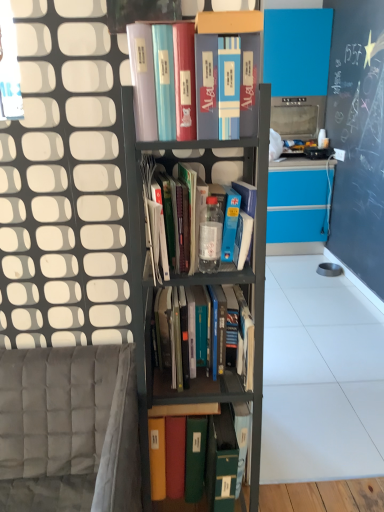
Question: From a real-world perspective, does gray fabric armchair at lower left sit lower than translucent plastic bottle at center, positioned as the 2th book in top-to-bottom order?

Choices:
 (A) yes
 (B) no

Answer: (A)

Question: Are gray fabric armchair at lower left and translucent plastic bottle at center, positioned as the 3th book in bottom-to-top order, located far from each other?

Choices:
 (A) no
 (B) yes

Answer: (A)

Question: From the image's perspective, would you say gray fabric armchair at lower left is shown under translucent plastic bottle at center, positioned as the 2th book in top-to-bottom order?

Choices:
 (A) yes
 (B) no

Answer: (A)

Question: Could you tell me if gray fabric armchair at lower left is facing translucent plastic bottle at center, positioned as the 2th book in top-to-bottom order?

Choices:
 (A) yes
 (B) no

Answer: (B)

Question: Is gray fabric armchair at lower left positioned in front of translucent plastic bottle at center, positioned as the 3th book in bottom-to-top order?

Choices:
 (A) no
 (B) yes

Answer: (B)

Question: Considering the relative positions of hardcover books at center, which appears as the 2th book when ordered from the bottom, and translucent plastic bottle at center, positioned as the 2th book in top-to-bottom order, in the image provided, is hardcover books at center, which appears as the 2th book when ordered from the bottom, to the left or to the right of translucent plastic bottle at center, positioned as the 2th book in top-to-bottom order,?

Choices:
 (A) left
 (B) right

Answer: (B)

Question: From a real-world perspective, relative to translucent plastic bottle at center, positioned as the 3th book in bottom-to-top order, is hardcover books at center, the 3th book in the top-to-bottom sequence, vertically above or below?

Choices:
 (A) above
 (B) below

Answer: (B)

Question: In terms of height, does hardcover books at center, which appears as the 2th book when ordered from the bottom, look taller or shorter compared to translucent plastic bottle at center, positioned as the 3th book in bottom-to-top order?

Choices:
 (A) short
 (B) tall

Answer: (A)

Question: Is hardcover books at center, the 3th book in the top-to-bottom sequence, spatially inside translucent plastic bottle at center, positioned as the 2th book in top-to-bottom order, or outside of it?

Choices:
 (A) inside
 (B) outside

Answer: (B)

Question: Is translucent plastic bottle at center, positioned as the 2th book in top-to-bottom order, taller or shorter than green matte folder at center, the first book ordered from the bottom?

Choices:
 (A) tall
 (B) short

Answer: (B)

Question: Considering the relative positions of translucent plastic bottle at center, positioned as the 2th book in top-to-bottom order, and green matte folder at center, which is the 4th book in top-to-bottom order, in the image provided, is translucent plastic bottle at center, positioned as the 2th book in top-to-bottom order, to the left or to the right of green matte folder at center, which is the 4th book in top-to-bottom order,?

Choices:
 (A) right
 (B) left

Answer: (B)

Question: From a real-world perspective, is translucent plastic bottle at center, positioned as the 3th book in bottom-to-top order, positioned above or below green matte folder at center, the first book ordered from the bottom?

Choices:
 (A) above
 (B) below

Answer: (A)

Question: Is point (253, 252) closer or farther from the camera than point (192, 404)?

Choices:
 (A) farther
 (B) closer

Answer: (B)

Question: Is point (208, 44) positioned closer to the camera than point (155, 411)?

Choices:
 (A) closer
 (B) farther

Answer: (A)

Question: Looking at their shapes, would you say matte plastic books at upper center, the 1th book when ordered from top to bottom, is wider or thinner than green matte folder at center, which is the 4th book in top-to-bottom order?

Choices:
 (A) thin
 (B) wide

Answer: (A)